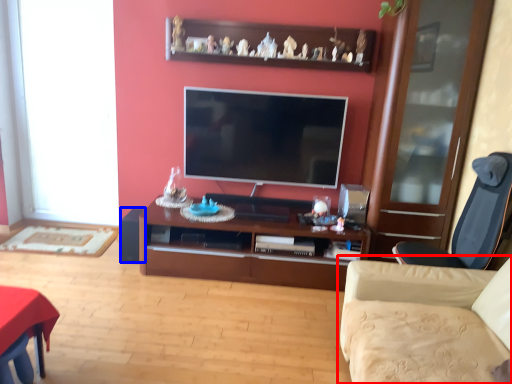
Question: Which object appears closest to the camera in this image, studio couch (highlighted by a red box) or speaker (highlighted by a blue box)?

Choices:
 (A) studio couch
 (B) speaker

Answer: (A)